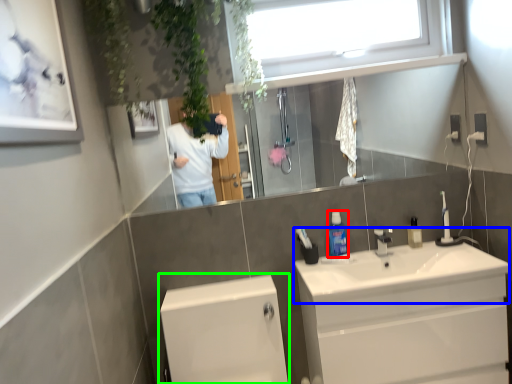
Question: Based on their relative distances, which object is nearer to mouthwash (highlighted by a red box)? Choose from sink (highlighted by a blue box) and bath (highlighted by a green box).

Choices:
 (A) sink
 (B) bath

Answer: (A)